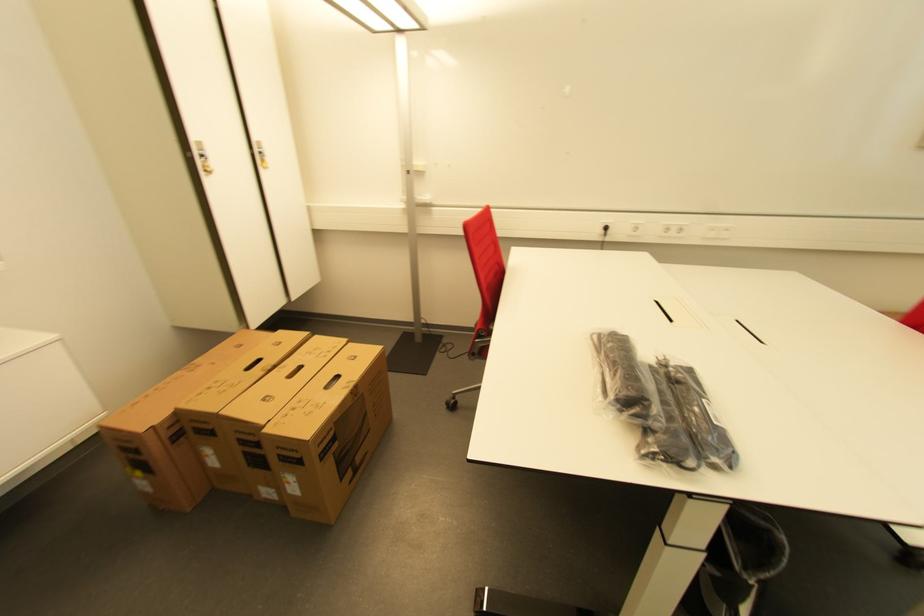
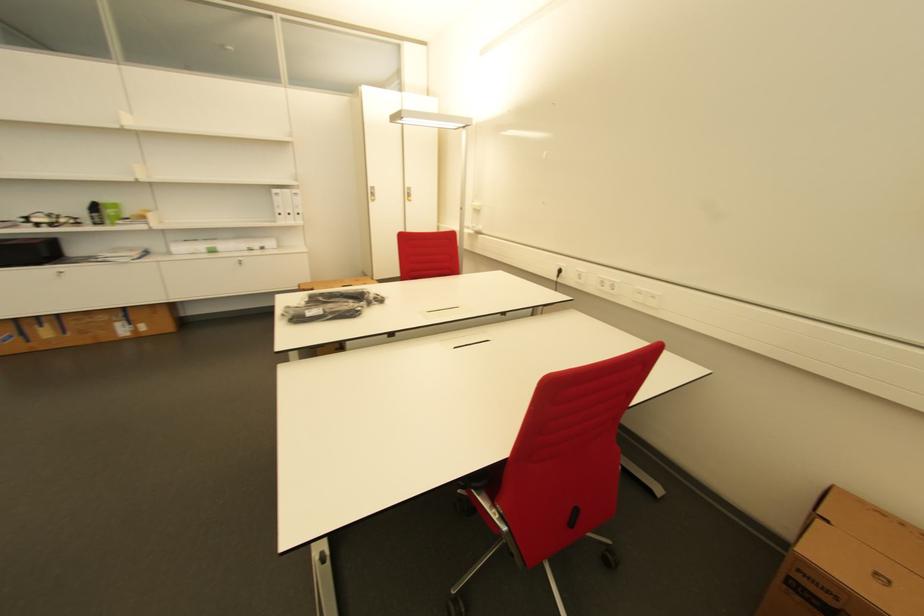
The point at (731, 231) is marked in the first image. Where is the corresponding point in the second image?

(659, 299)